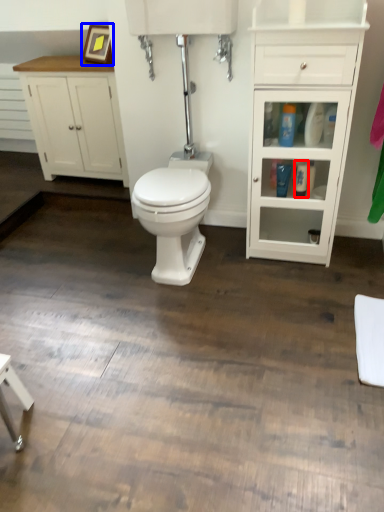
Question: Which point is further to the camera, toiletry (highlighted by a red box) or picture frame (highlighted by a blue box)?

Choices:
 (A) toiletry
 (B) picture frame

Answer: (B)